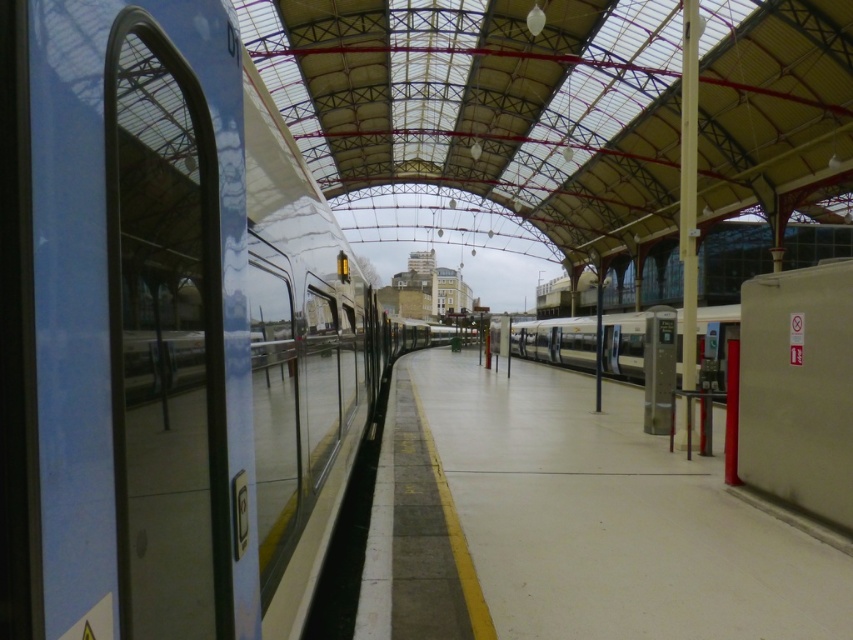
Question: Among these points, which one is nearest to the camera?

Choices:
 (A) (611, 337)
 (B) (96, 268)

Answer: (B)

Question: Is polished silver train at center smaller than silver metallic train at center?

Choices:
 (A) no
 (B) yes

Answer: (B)

Question: Among these points, which one is farthest from the camera?

Choices:
 (A) (47, 168)
 (B) (524, 332)

Answer: (B)

Question: Is polished silver train at center smaller than silver metallic train at center?

Choices:
 (A) yes
 (B) no

Answer: (A)

Question: Is the position of polished silver train at center less distant than that of silver metallic train at center?

Choices:
 (A) no
 (B) yes

Answer: (B)